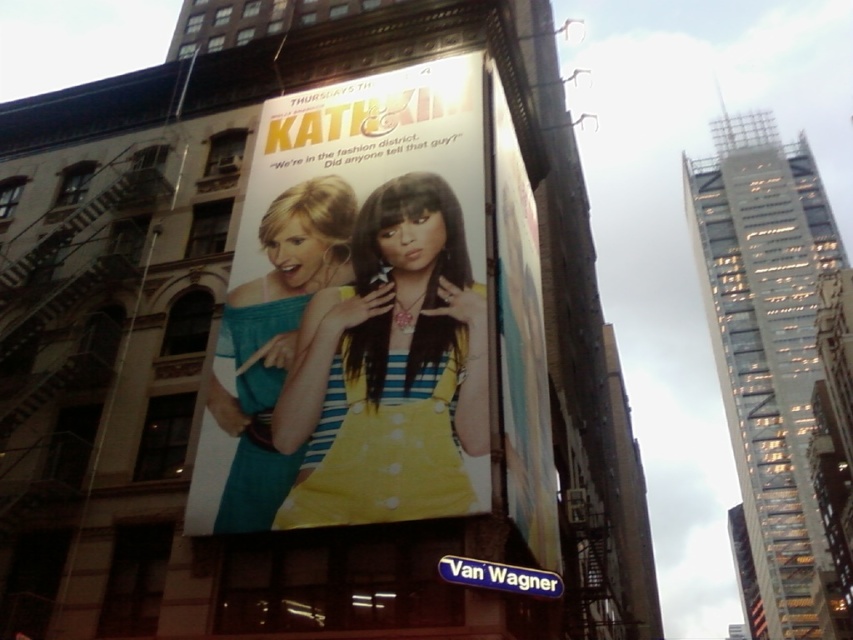
Question: Considering the real-world distances, which object is closest to the yellow striped dress at center?

Choices:
 (A) matte paper poster at center
 (B) teal fabric dress at center

Answer: (A)

Question: Considering the real-world distances, which object is farthest from the matte paper poster at center?

Choices:
 (A) teal fabric dress at center
 (B) yellow striped dress at center

Answer: (A)

Question: Where is matte paper poster at center located in relation to teal fabric dress at center in the image?

Choices:
 (A) above
 (B) below

Answer: (A)

Question: Does yellow striped dress at center appear over teal fabric dress at center?

Choices:
 (A) yes
 (B) no

Answer: (A)

Question: Which object is positioned closest to the teal fabric dress at center?

Choices:
 (A) matte paper poster at center
 (B) yellow striped dress at center

Answer: (A)

Question: Where is yellow striped dress at center located in relation to teal fabric dress at center in the image?

Choices:
 (A) above
 (B) below

Answer: (A)